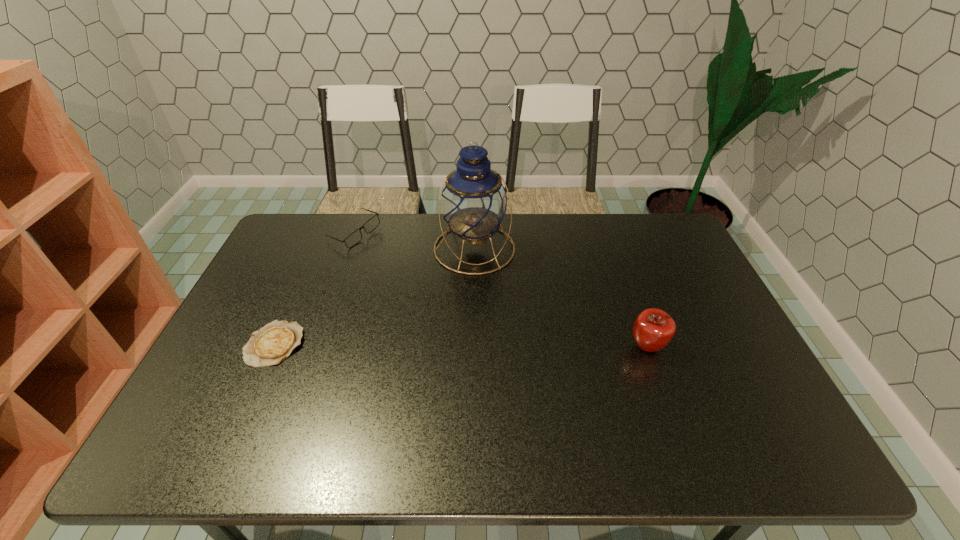
The width and height of the screenshot is (960, 540). What are the coordinates of `vacant space located 0.300m on the front-facing side of the lantern` in the screenshot? It's located at (494, 350).

Where is `free space located 0.310m with the lenses facing outward on the spectacles`? The height and width of the screenshot is (540, 960). free space located 0.310m with the lenses facing outward on the spectacles is located at coordinates (390, 308).

Where is `vacant area located 0.050m with the lenses facing outward on the spectacles`? This screenshot has height=540, width=960. vacant area located 0.050m with the lenses facing outward on the spectacles is located at coordinates (365, 257).

Where is `free region located with the lenses facing outward on the spectacles`? This screenshot has width=960, height=540. free region located with the lenses facing outward on the spectacles is located at coordinates (383, 295).

Identify the location of lantern situated at the far edge. The image size is (960, 540). (474, 201).

Where is `spectacles that is at the far edge`? This screenshot has width=960, height=540. spectacles that is at the far edge is located at coordinates (355, 237).

Locate an element on the screen. The height and width of the screenshot is (540, 960). object located in the left edge section of the desktop is located at coordinates (270, 345).

You are a GUI agent. You are given a task and a screenshot of the screen. Output one action in this format:
    pyautogui.click(x=<x>, y=<y>)
    Task: Click on the vacant space at the far edge of the desktop
    This screenshot has width=960, height=540.
    Given the screenshot: What is the action you would take?
    pyautogui.click(x=399, y=240)

In the image, there is a desktop. In order to click on vacant region at the near edge in this screenshot , I will do `click(612, 418)`.

Identify the location of free space at the left edge of the desktop. The height and width of the screenshot is (540, 960). tap(248, 322).